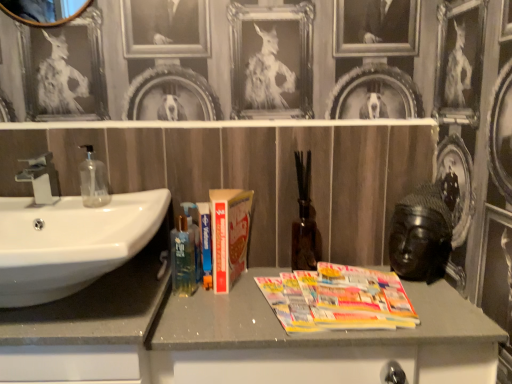
Locate an element on the screen. Image resolution: width=512 pixels, height=384 pixels. free space above multicolored glossy magazines at center (from a real-world perspective) is located at coordinates (302, 298).